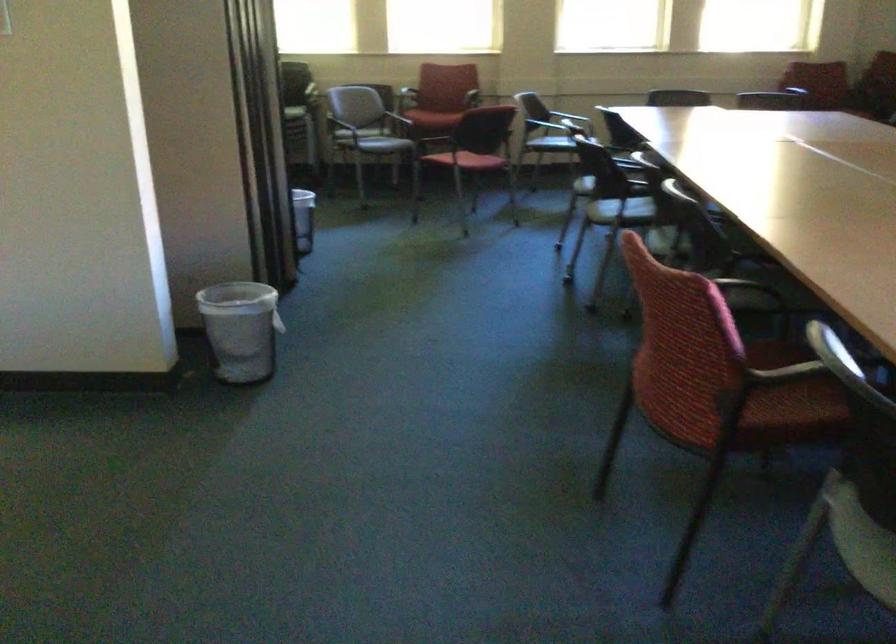
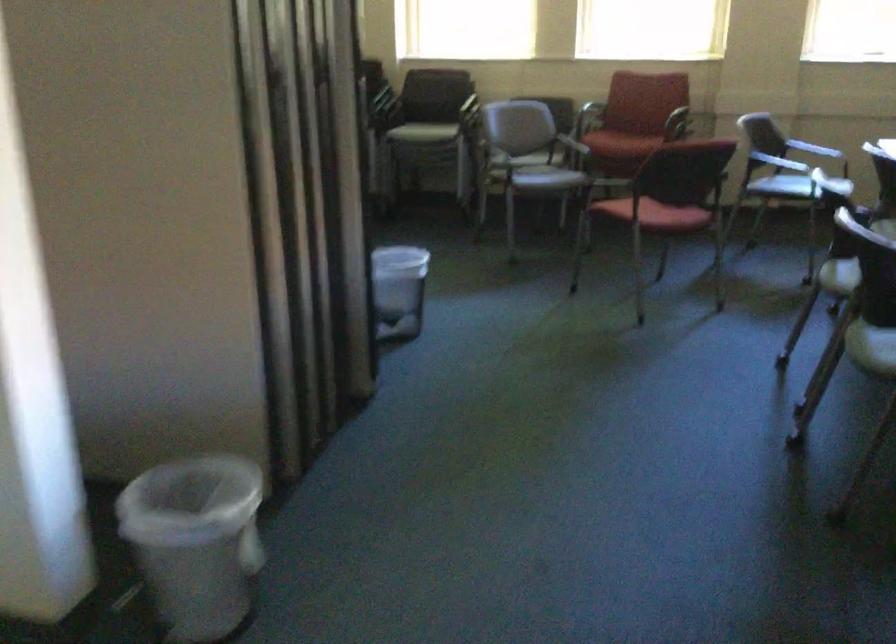
The point at (394, 151) is marked in the first image. Where is the corresponding point in the second image?

(545, 180)